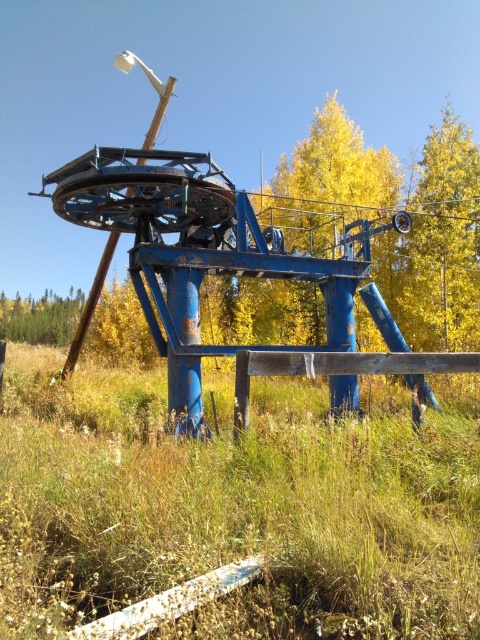
Question: Considering the real-world distances, which object is farthest from the yellow/golden wood at upper right?

Choices:
 (A) yellow leafy tree at center
 (B) green grassy at lower center

Answer: (B)

Question: Can you confirm if yellow leafy tree at center is wider than green matte tree at lower left?

Choices:
 (A) yes
 (B) no

Answer: (A)

Question: From the image, what is the correct spatial relationship of yellow/golden wood at upper right in relation to green matte tree at lower left?

Choices:
 (A) left
 (B) right

Answer: (B)

Question: Which point is farther to the camera?

Choices:
 (A) yellow leafy tree at center
 (B) yellow/golden wood at upper right
 (C) green matte tree at lower left

Answer: (C)

Question: Among these objects, which one is nearest to the camera?

Choices:
 (A) yellow/golden wood at upper right
 (B) yellow leafy tree at center
 (C) green matte tree at lower left

Answer: (A)

Question: Does green grassy at lower center come in front of yellow leafy tree at center?

Choices:
 (A) yes
 (B) no

Answer: (A)